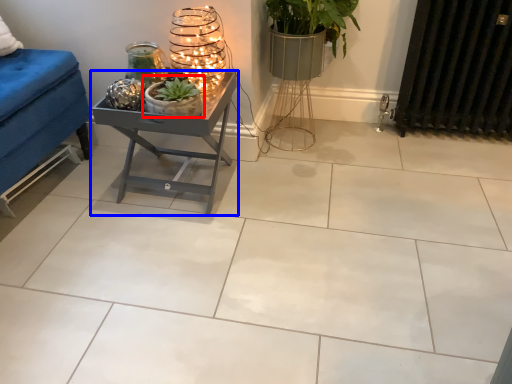
Question: Which of the following is the closest to the observer, houseplant (highlighted by a red box) or table (highlighted by a blue box)?

Choices:
 (A) houseplant
 (B) table

Answer: (A)